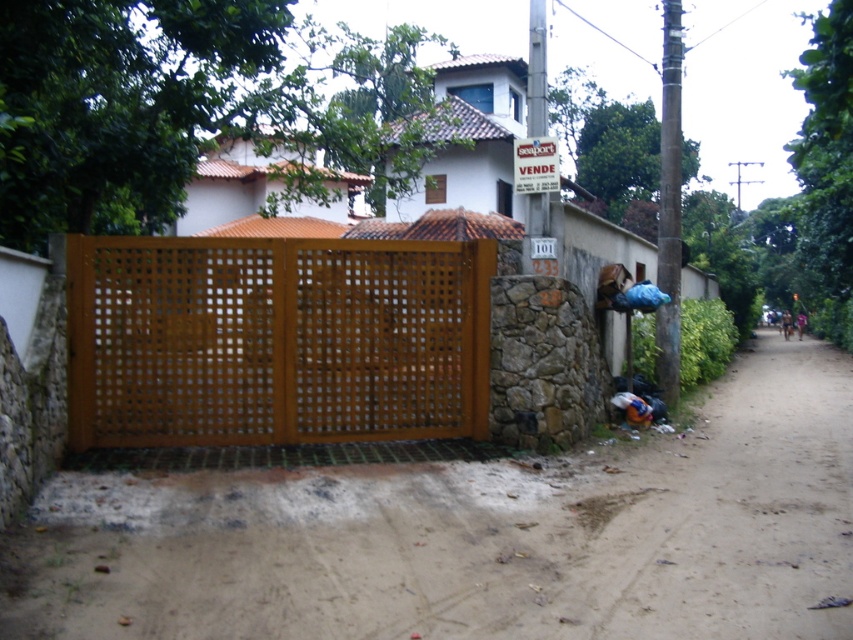
Is point (282, 476) farther from camera compared to point (258, 396)?

No, it is not.

Does brown sandy dirt track at lower center have a greater width compared to brown wooden fence at center?

Yes.

Between point (811, 563) and point (161, 237), which one is positioned behind?

The point (161, 237) is more distant.

The height and width of the screenshot is (640, 853). In order to click on brown sandy dirt track at lower center in this screenshot , I will do `click(476, 536)`.